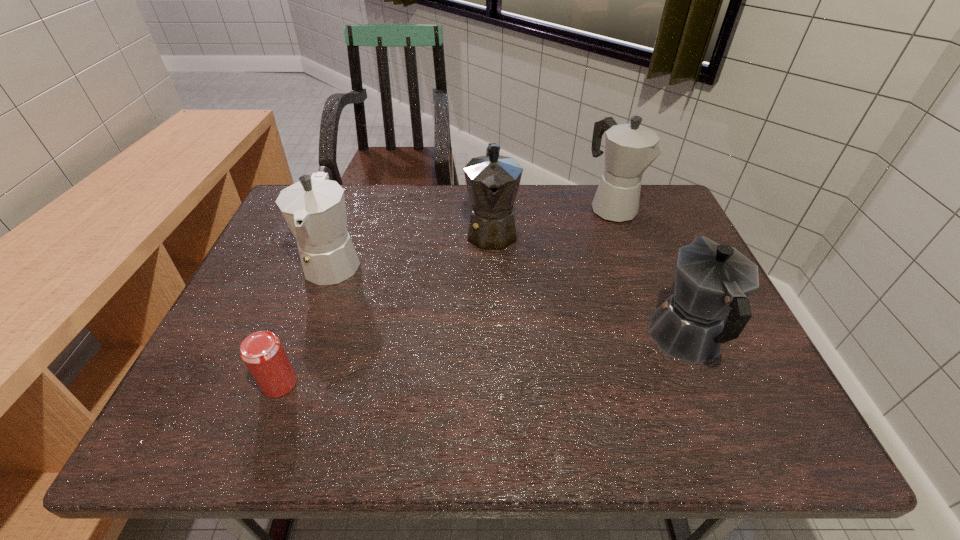
The image size is (960, 540). Identify the location of coffeepot located in the left edge section of the desktop. (314, 208).

Identify the location of beer can located in the left edge section of the desktop. The width and height of the screenshot is (960, 540). (262, 352).

I want to click on object that is at the far right corner, so [629, 148].

This screenshot has height=540, width=960. What are the coordinates of `blank space at the far edge` in the screenshot? It's located at (440, 184).

Locate an element on the screen. free space at the near edge of the desktop is located at coordinates (296, 416).

In the image, there is a desktop. Where is `blank space at the left edge`? blank space at the left edge is located at coordinates (263, 262).

Image resolution: width=960 pixels, height=540 pixels. In the image, there is a desktop. What are the coordinates of `free space at the right edge` in the screenshot? It's located at (732, 351).

Identify the location of blank space at the far right corner of the desktop. Image resolution: width=960 pixels, height=540 pixels. (656, 186).

Locate an element on the screen. This screenshot has height=540, width=960. vacant point at the near right corner is located at coordinates (722, 447).

This screenshot has height=540, width=960. In order to click on empty space between the third object from left to right and the leftmost coffeepot in this screenshot , I will do `click(413, 245)`.